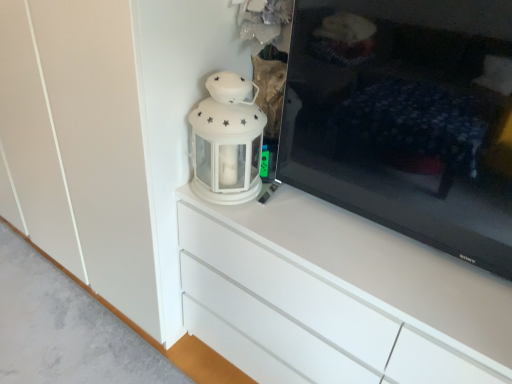
At what (x,y) coordinates should I click in order to perform the action: click on free space underneath black glossy tv at right (from a real-world perspective). Please return your answer as a coordinate pair (x, y). Looking at the image, I should click on (376, 227).